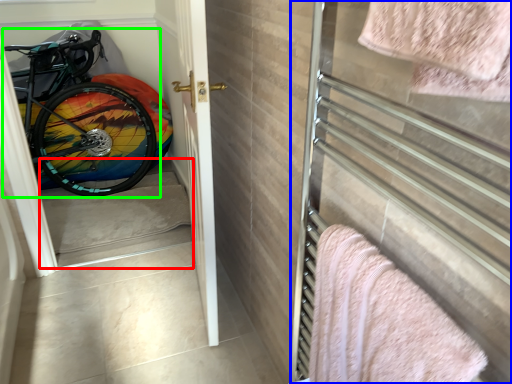
Question: Based on their relative distances, which object is nearer to stairwell (highlighted by a red box)? Choose from screen door (highlighted by a blue box) and bicycle (highlighted by a green box).

Choices:
 (A) screen door
 (B) bicycle

Answer: (B)